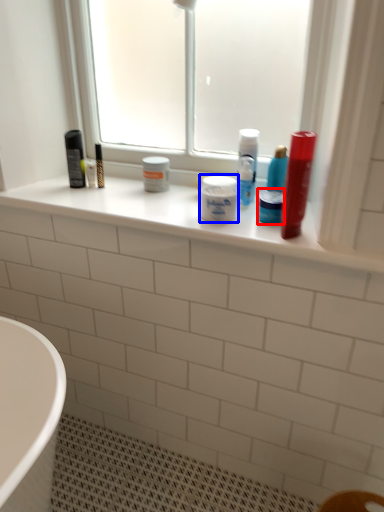
Question: Which object appears closest to the camera in this image, mouthwash (highlighted by a red box) or toiletry (highlighted by a blue box)?

Choices:
 (A) mouthwash
 (B) toiletry

Answer: (B)